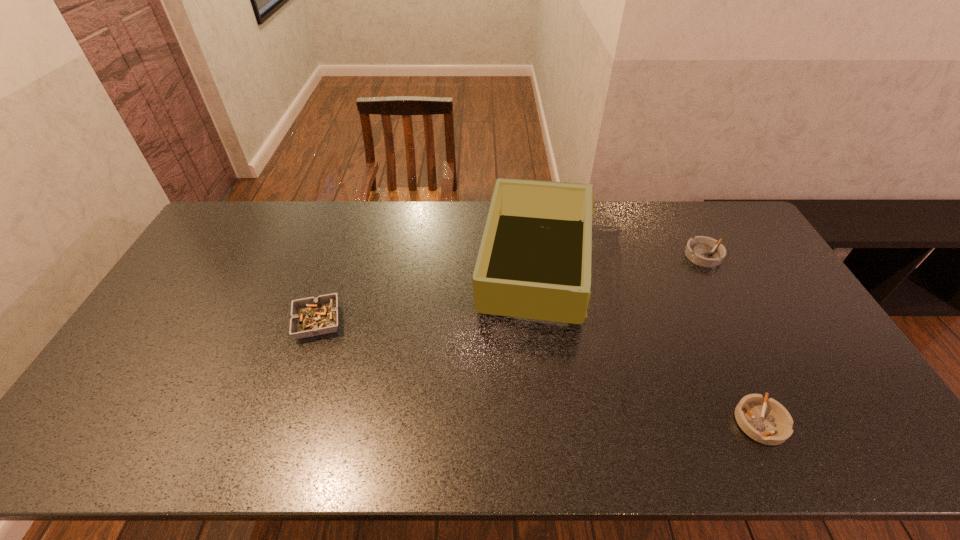
At what (x,y) coordinates should I click in order to perform the action: click on object that is at the far edge. Please return your answer as a coordinate pair (x, y). Looking at the image, I should click on (534, 261).

Find the location of a particular element. This screenshot has height=540, width=960. object that is at the near edge is located at coordinates (765, 420).

I want to click on object that is at the right edge, so click(x=704, y=251).

The image size is (960, 540). I want to click on vacant area at the far edge, so click(391, 204).

The width and height of the screenshot is (960, 540). In the image, there is a desktop. Find the location of `free space at the near edge`. free space at the near edge is located at coordinates (323, 430).

At what (x,y) coordinates should I click in order to perform the action: click on vacant space at the left edge of the desktop. Please return your answer as a coordinate pair (x, y). Looking at the image, I should click on (207, 305).

In the image, there is a desktop. Where is `vacant space at the right edge`? This screenshot has height=540, width=960. vacant space at the right edge is located at coordinates (756, 255).

The height and width of the screenshot is (540, 960). In order to click on free space at the near left corner of the desktop in this screenshot , I will do `click(119, 446)`.

Image resolution: width=960 pixels, height=540 pixels. I want to click on unoccupied position between the second object from left to right and the nearest object, so click(647, 345).

Identify the location of vacant area between the farthest ashtray and the tallest object. This screenshot has height=540, width=960. (619, 262).